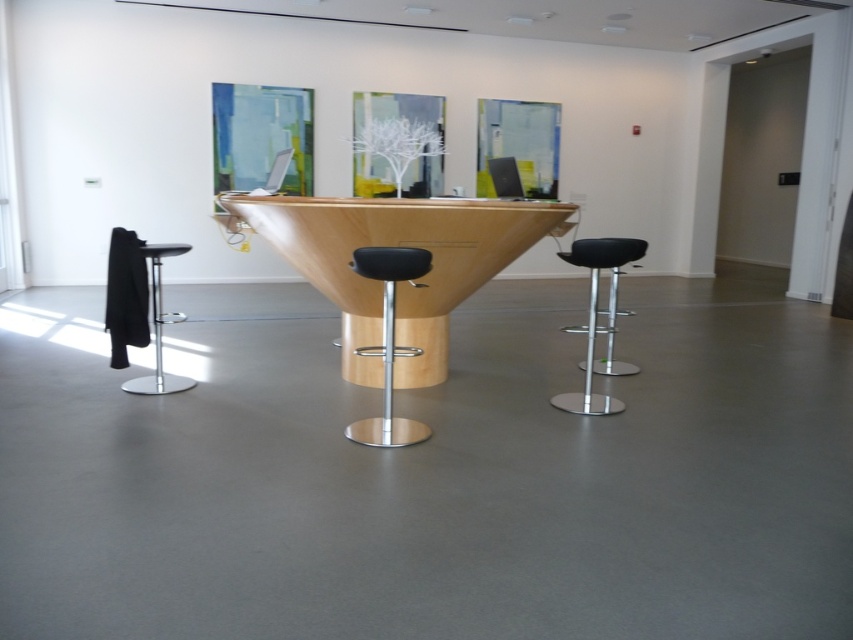
Question: Considering the relative positions of beech wood table at center and black leather bar stool at left in the image provided, where is beech wood table at center located with respect to black leather bar stool at left?

Choices:
 (A) left
 (B) right

Answer: (B)

Question: Which object appears farthest from the camera in this image?

Choices:
 (A) black leather bar stool at left
 (B) beech wood table at center

Answer: (A)

Question: Which of the following is the closest to the observer?

Choices:
 (A) (140, 378)
 (B) (619, 259)
 (C) (260, 204)
 (D) (410, 420)

Answer: (D)

Question: Is black leather bar stool at center closer to the viewer compared to black leather bar stool at left?

Choices:
 (A) yes
 (B) no

Answer: (A)

Question: Is black leather bar stool at right closer to camera compared to black leather bar stool at left?

Choices:
 (A) yes
 (B) no

Answer: (A)

Question: Which point is farther from the camera taking this photo?

Choices:
 (A) (403, 355)
 (B) (585, 369)
 (C) (358, 275)
 (D) (158, 324)

Answer: (B)